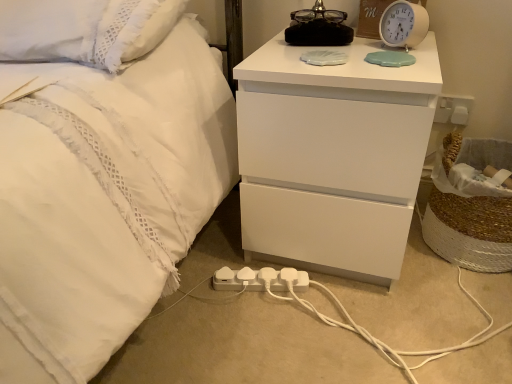
Question: From the image's perspective, would you say white plastic alarm clock at upper right is shown under white matte nightstand at upper right?

Choices:
 (A) yes
 (B) no

Answer: (B)

Question: Considering the relative positions of white plastic alarm clock at upper right and white matte nightstand at upper right in the image provided, is white plastic alarm clock at upper right in front of white matte nightstand at upper right?

Choices:
 (A) no
 (B) yes

Answer: (A)

Question: Is white plastic alarm clock at upper right far away from white matte nightstand at upper right?

Choices:
 (A) no
 (B) yes

Answer: (A)

Question: Would you say white matte nightstand at upper right is part of white plastic alarm clock at upper right's contents?

Choices:
 (A) yes
 (B) no

Answer: (B)

Question: Is white plastic alarm clock at upper right shorter than white matte nightstand at upper right?

Choices:
 (A) yes
 (B) no

Answer: (A)

Question: In terms of size, does white plastic extension cord at lower center appear bigger or smaller than white matte nightstand at upper right?

Choices:
 (A) small
 (B) big

Answer: (A)

Question: From the image's perspective, is white plastic extension cord at lower center positioned above or below white matte nightstand at upper right?

Choices:
 (A) below
 (B) above

Answer: (A)

Question: In the image, is white plastic extension cord at lower center on the left side or the right side of white matte nightstand at upper right?

Choices:
 (A) left
 (B) right

Answer: (A)

Question: Considering the positions of white plastic extension cord at lower center and white matte nightstand at upper right in the image, is white plastic extension cord at lower center taller or shorter than white matte nightstand at upper right?

Choices:
 (A) tall
 (B) short

Answer: (B)

Question: Is white matte nightstand at upper right spatially inside white plastic extension cord at lower center, or outside of it?

Choices:
 (A) outside
 (B) inside

Answer: (A)

Question: From a real-world perspective, is white matte nightstand at upper right physically located above or below white plastic extension cord at lower center?

Choices:
 (A) above
 (B) below

Answer: (A)

Question: From the image's perspective, is white matte nightstand at upper right above or below white plastic extension cord at lower center?

Choices:
 (A) below
 (B) above

Answer: (B)

Question: Is white matte nightstand at upper right bigger or smaller than white plastic extension cord at lower center?

Choices:
 (A) small
 (B) big

Answer: (B)

Question: From the image's perspective, is white plastic alarm clock at upper right above or below white plastic extension cord at lower center?

Choices:
 (A) above
 (B) below

Answer: (A)

Question: Looking at the image, does white plastic alarm clock at upper right seem bigger or smaller compared to white plastic extension cord at lower center?

Choices:
 (A) small
 (B) big

Answer: (B)